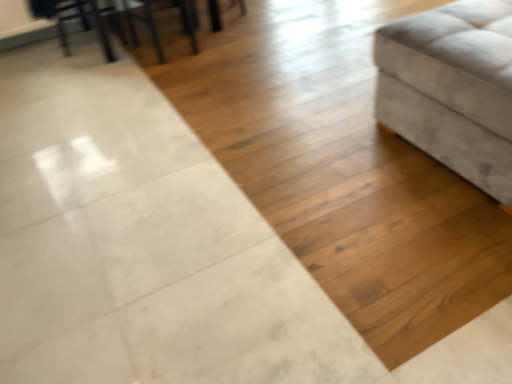
Question: Does metallic silver swivel chair at upper left have a greater height compared to metallic black chair at upper left?

Choices:
 (A) no
 (B) yes

Answer: (A)

Question: Are metallic silver swivel chair at upper left and metallic black chair at upper left making contact?

Choices:
 (A) yes
 (B) no

Answer: (B)

Question: From a real-world perspective, is metallic silver swivel chair at upper left located beneath metallic black chair at upper left?

Choices:
 (A) no
 (B) yes

Answer: (B)

Question: Is the position of metallic silver swivel chair at upper left more distant than that of metallic black chair at upper left?

Choices:
 (A) yes
 (B) no

Answer: (A)

Question: Can you confirm if metallic silver swivel chair at upper left is bigger than metallic black chair at upper left?

Choices:
 (A) no
 (B) yes

Answer: (B)

Question: Is metallic silver swivel chair at upper left thinner than metallic black chair at upper left?

Choices:
 (A) no
 (B) yes

Answer: (A)

Question: Is metallic silver swivel chair at upper left at the left side of suede-like beige ottoman at right?

Choices:
 (A) yes
 (B) no

Answer: (A)

Question: Can you confirm if metallic silver swivel chair at upper left is thinner than suede-like beige ottoman at right?

Choices:
 (A) yes
 (B) no

Answer: (A)

Question: Can you confirm if metallic silver swivel chair at upper left is wider than suede-like beige ottoman at right?

Choices:
 (A) yes
 (B) no

Answer: (B)

Question: Does metallic silver swivel chair at upper left come in front of suede-like beige ottoman at right?

Choices:
 (A) yes
 (B) no

Answer: (B)

Question: From the image's perspective, does metallic silver swivel chair at upper left appear lower than suede-like beige ottoman at right?

Choices:
 (A) no
 (B) yes

Answer: (A)

Question: From a real-world perspective, is metallic silver swivel chair at upper left positioned over suede-like beige ottoman at right based on gravity?

Choices:
 (A) no
 (B) yes

Answer: (A)

Question: Is metallic black chair at upper left positioned in front of metallic silver swivel chair at upper left?

Choices:
 (A) no
 (B) yes

Answer: (B)